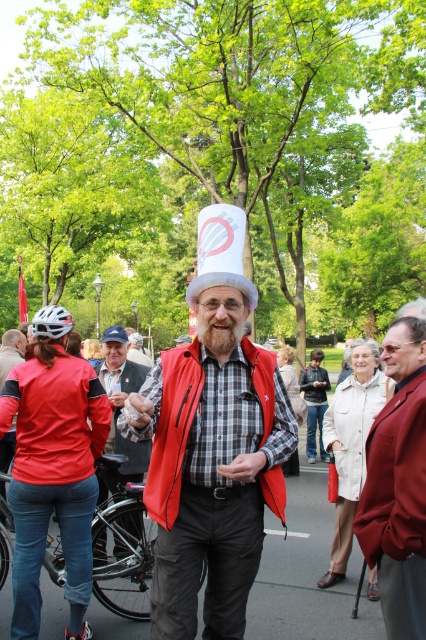
Does smooth red jacket at center have a larger size compared to red matte vest at center?

Incorrect, smooth red jacket at center is not larger than red matte vest at center.

Looking at this image, how far apart are smooth red jacket at center and red matte vest at center?

smooth red jacket at center is 24.61 inches away from red matte vest at center.

Locate an element on the screen. This screenshot has height=640, width=426. smooth red jacket at center is located at coordinates (397, 484).

Does brown fuzzy beard at center appear on the right side of white paper hat at center?

Correct, you'll find brown fuzzy beard at center to the right of white paper hat at center.

Between brown fuzzy beard at center and white paper hat at center, which one is positioned lower?

Positioned lower is white paper hat at center.

Is point (233, 310) farther from camera compared to point (112, 339)?

No.

I want to click on brown fuzzy beard at center, so click(x=219, y=326).

Between matte red jacket at left and white fabric hat at center, which one appears on the right side from the viewer's perspective?

Positioned to the right is white fabric hat at center.

Can you confirm if matte red jacket at left is positioned to the left of white fabric hat at center?

Correct, you'll find matte red jacket at left to the left of white fabric hat at center.

Find the location of `matte red jacket at left`. matte red jacket at left is located at coordinates click(54, 419).